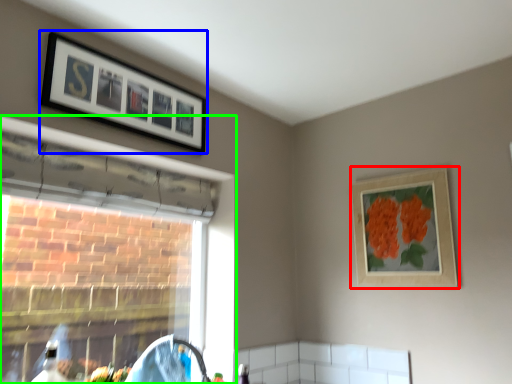
Question: Based on their relative distances, which object is nearer to picture frame (highlighted by a red box)? Choose from picture frame (highlighted by a blue box) and window (highlighted by a green box).

Choices:
 (A) picture frame
 (B) window

Answer: (B)